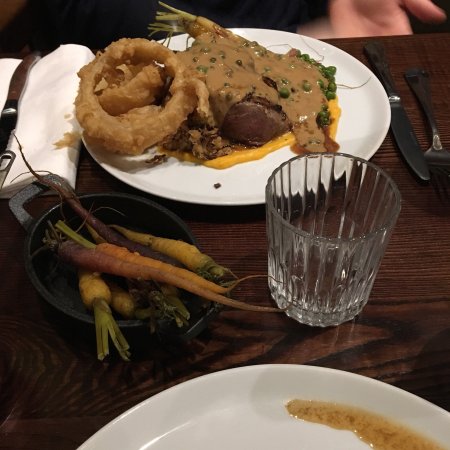
Where is `plates`? plates is located at coordinates (239, 425), (237, 176).